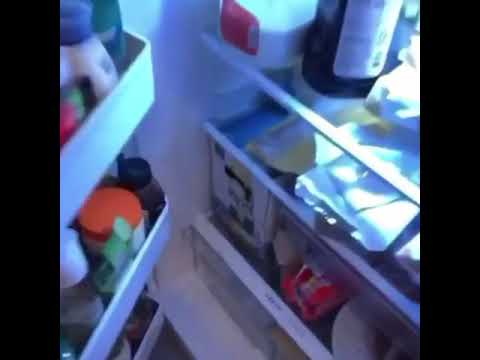
What are the coordinates of `bottle` in the screenshot? It's located at (116, 37).